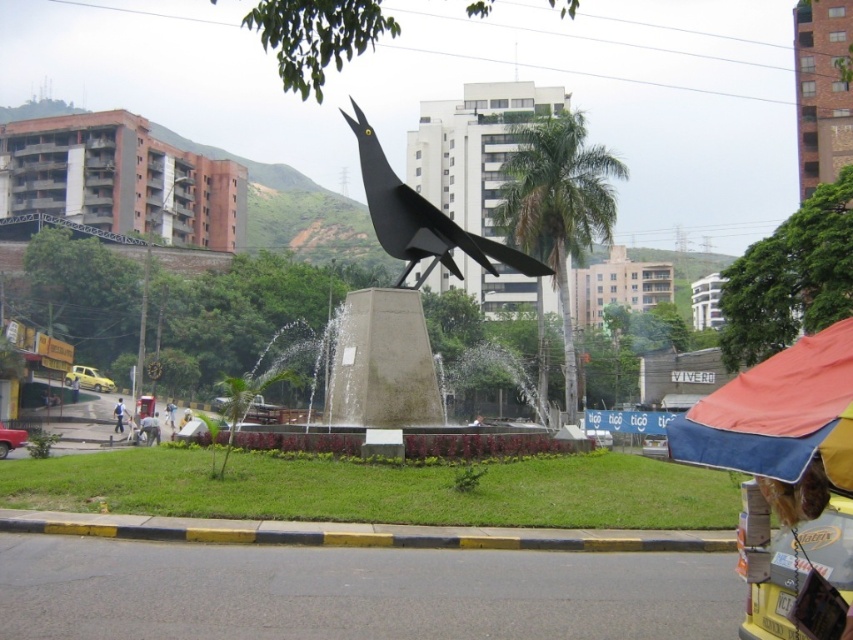
Which of these two, black matte bird at center or light blue jeans at lower left, stands shorter?

Standing shorter between the two is light blue jeans at lower left.

Measure the distance between black matte bird at center and light blue jeans at lower left.

black matte bird at center and light blue jeans at lower left are 72.70 feet apart from each other.

This screenshot has width=853, height=640. What do you see at coordinates (421, 218) in the screenshot?
I see `black matte bird at center` at bounding box center [421, 218].

Where is `black matte bird at center`? black matte bird at center is located at coordinates (421, 218).

Who is taller, orange fabric umbrella at lower right or light brown leather jacket at center?

orange fabric umbrella at lower right

Does orange fabric umbrella at lower right appear under light brown leather jacket at center?

Incorrect, orange fabric umbrella at lower right is not positioned below light brown leather jacket at center.

Who is more distant from viewer, (807, 387) or (167, 420)?

The point (167, 420) is behind.

Where is `orange fabric umbrella at lower right`? This screenshot has width=853, height=640. orange fabric umbrella at lower right is located at coordinates (776, 413).

Can you confirm if black matte bird at center is shorter than light brown leather jacket at center?

No, black matte bird at center is not shorter than light brown leather jacket at center.

Does black matte bird at center appear under light brown leather jacket at center?

No, black matte bird at center is not below light brown leather jacket at center.

Between point (447, 225) and point (173, 417), which one is positioned in front?

Positioned in front is point (447, 225).

The width and height of the screenshot is (853, 640). Find the location of `black matte bird at center`. black matte bird at center is located at coordinates (421, 218).